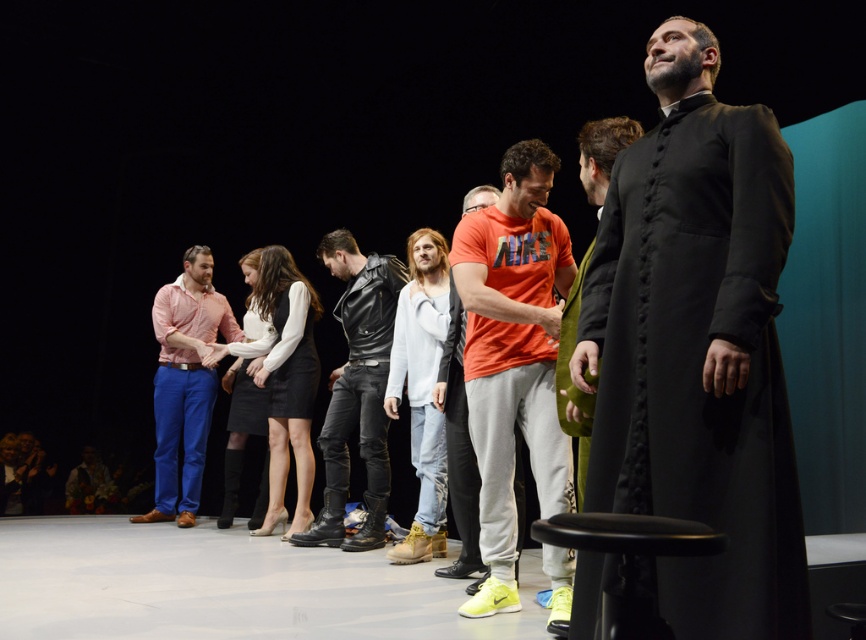
In order to click on white cotton shirt at center in this screenshot , I will do coord(421,387).

Between white cotton shirt at center and orange matte t-shirt at center, which one has more height?

Standing taller between the two is white cotton shirt at center.

The height and width of the screenshot is (640, 866). Identify the location of white cotton shirt at center. (421, 387).

Who is positioned more to the right, orange cotton t-shirt at center or matte pink shirt at center?

orange cotton t-shirt at center is more to the right.

Identify the location of orange cotton t-shirt at center. The width and height of the screenshot is (866, 640). (514, 355).

Which is above, black matte robe at center or orange cotton t-shirt at center?

black matte robe at center

Does black matte robe at center have a greater width compared to orange cotton t-shirt at center?

Indeed, black matte robe at center has a greater width compared to orange cotton t-shirt at center.

Does point (768, 538) lie behind point (546, 173)?

No.

Image resolution: width=866 pixels, height=640 pixels. Find the location of `black matte robe at center`. black matte robe at center is located at coordinates [698, 348].